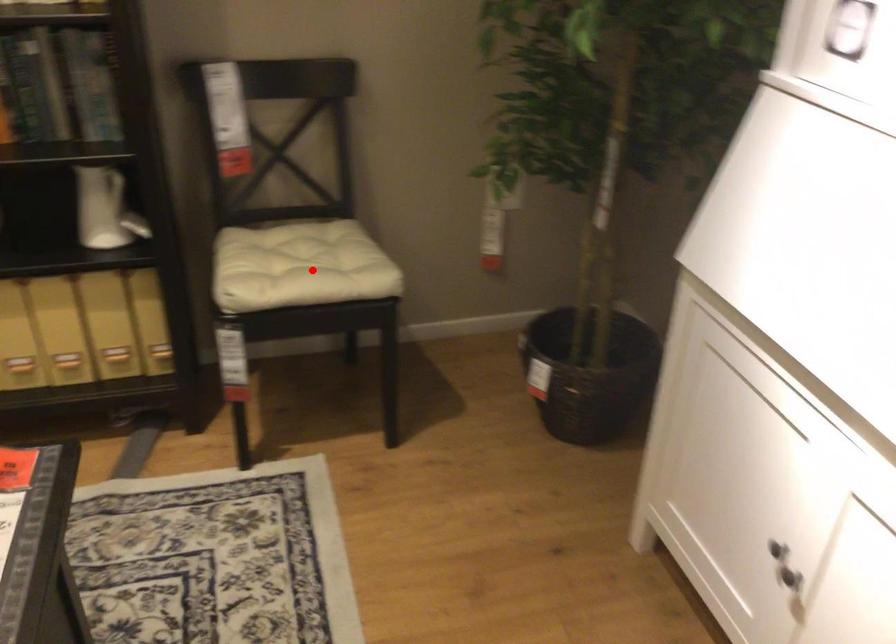
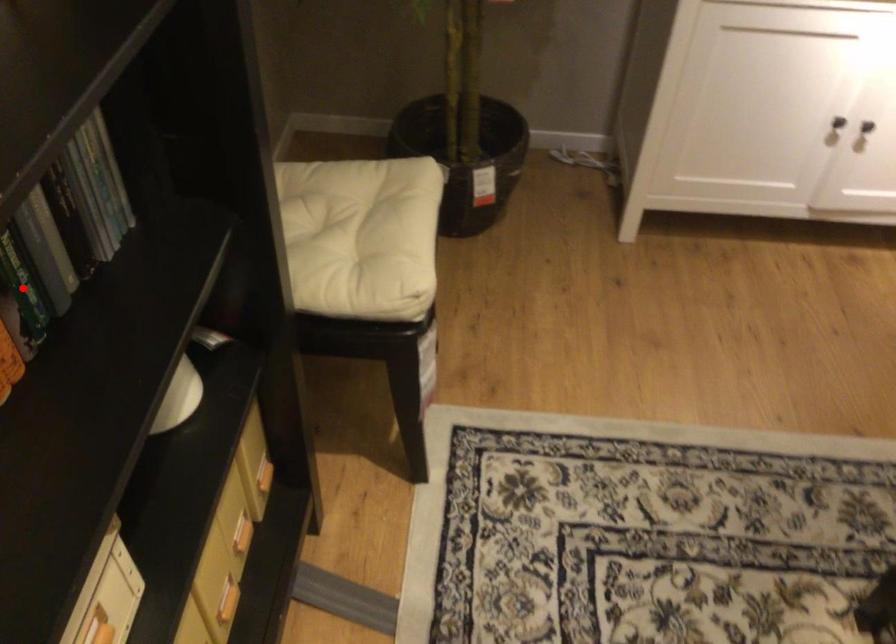
I am providing you with two images of the same scene from different viewpoints. A red point is marked on the first image and another point is marked on the second image. Does the point marked in image1 correspond to the same location as the one in image2?

No